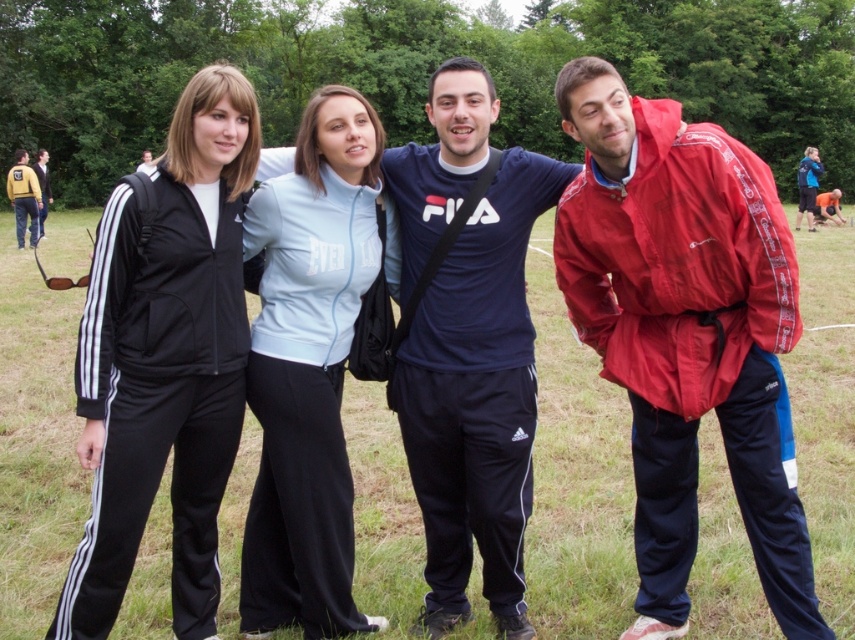
Question: Which of these objects is positioned closest to the orange fabric shirt at right?

Choices:
 (A) brushed metal jacket at left
 (B) matte black jacket at center

Answer: (A)

Question: From the image, what is the correct spatial relationship of red nylon jacket at center in relation to black track suit at left?

Choices:
 (A) above
 (B) below

Answer: (B)

Question: Estimate the real-world distances between objects in this image. Which object is closer to the blue cotton shirt at center?

Choices:
 (A) brushed metal jacket at left
 (B) light blue fleece at center
 (C) red nylon jacket at center
 (D) matte black jacket at center

Answer: (B)

Question: Which point appears farthest from the camera in this image?

Choices:
 (A) (777, 250)
 (B) (806, 157)
 (C) (139, 170)
 (D) (42, 189)

Answer: (B)

Question: Can you confirm if black track suit at left is thinner than orange fabric shirt at right?

Choices:
 (A) no
 (B) yes

Answer: (B)

Question: Observing the image, what is the correct spatial positioning of black track suit at left in reference to blue cotton shirt at center?

Choices:
 (A) above
 (B) below

Answer: (A)